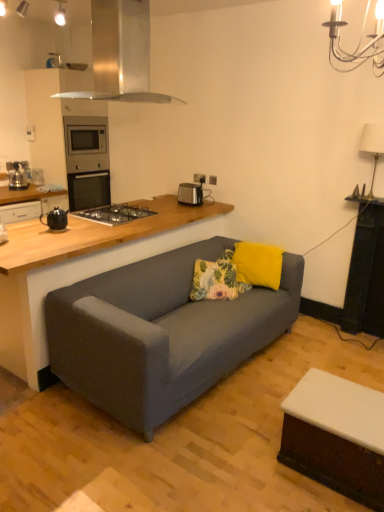
Identify the location of free space in front of black ceramic teapot at left, which is counted as the 2th appliance, starting from the top. The image size is (384, 512). (47, 232).